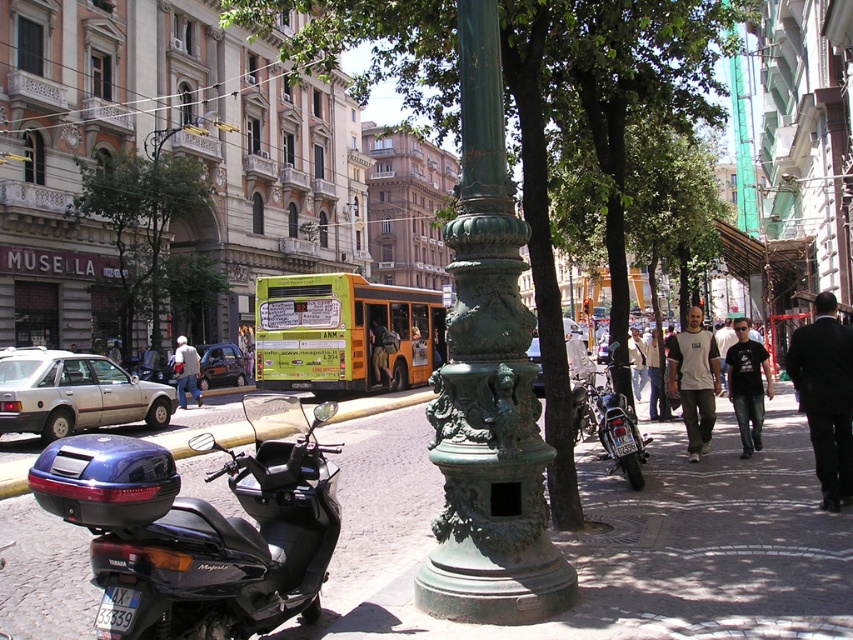
Can you confirm if black glossy scooter at lower left is thinner than green patinated metal streetlamp at upper left?

Indeed, black glossy scooter at lower left has a lesser width compared to green patinated metal streetlamp at upper left.

Is black glossy scooter at lower left to the left of green patinated metal streetlamp at upper left from the viewer's perspective?

No, black glossy scooter at lower left is not to the left of green patinated metal streetlamp at upper left.

You are a GUI agent. You are given a task and a screenshot of the screen. Output one action in this format:
    pyautogui.click(x=<x>, y=<y>)
    Task: Click on the black glossy scooter at lower left
    
    Given the screenshot: What is the action you would take?
    pyautogui.click(x=201, y=528)

Does green textured pole at center have a larger size compared to yellow matte bus at center?

Yes.

Is point (577, 522) closer to viewer compared to point (281, 332)?

Yes, point (577, 522) is in front of point (281, 332).

Where is `green textured pole at center`? This screenshot has width=853, height=640. green textured pole at center is located at coordinates (602, 90).

Is green patinated metal pole at center bigger than yellow matte bus at center?

No, green patinated metal pole at center is not bigger than yellow matte bus at center.

Is point (532, 412) positioned in front of point (318, 362)?

Yes, it is.

Find the location of a particular element. This screenshot has width=853, height=640. green patinated metal pole at center is located at coordinates (488, 384).